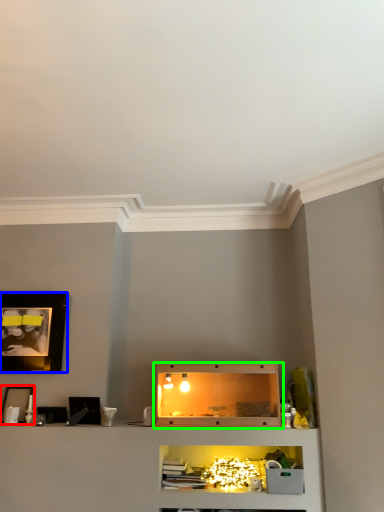
Question: Which object is the closest to the picture frame (highlighted by a red box)? Choose among these: picture frame (highlighted by a blue box) or shelf (highlighted by a green box).

Choices:
 (A) picture frame
 (B) shelf

Answer: (A)